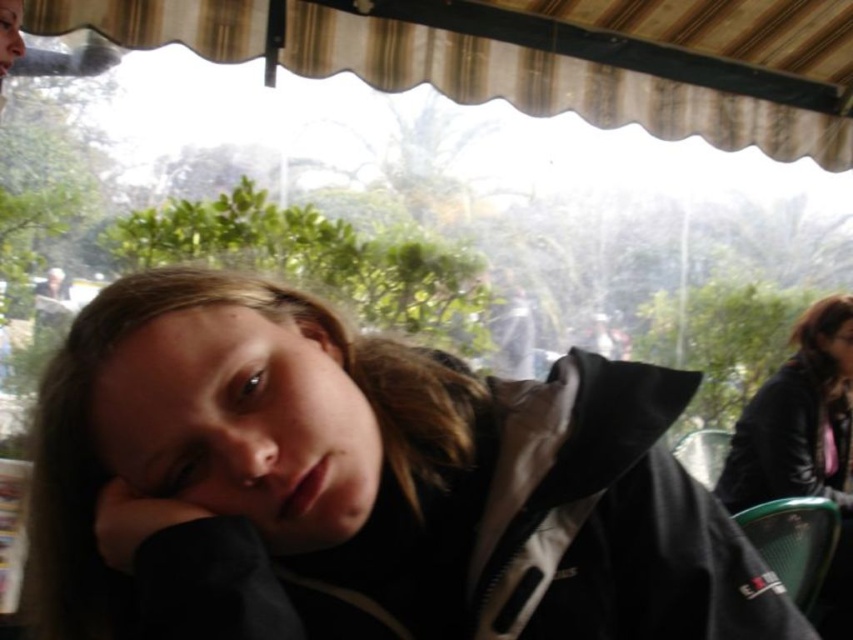
Question: Among these objects, which one is nearest to the camera?

Choices:
 (A) black leather jacket at upper right
 (B) beige fabric canopy at upper center
 (C) black matte jacket at center

Answer: (C)

Question: Can you confirm if black matte jacket at center is smaller than black leather jacket at upper right?

Choices:
 (A) yes
 (B) no

Answer: (A)

Question: Is black matte jacket at center above black leather jacket at upper right?

Choices:
 (A) yes
 (B) no

Answer: (A)

Question: Which is nearer to the black leather jacket at upper right?

Choices:
 (A) black matte jacket at center
 (B) beige fabric canopy at upper center

Answer: (B)

Question: Does beige fabric canopy at upper center have a greater width compared to black leather jacket at upper right?

Choices:
 (A) yes
 (B) no

Answer: (A)

Question: Which point is farther to the camera?

Choices:
 (A) (314, 54)
 (B) (741, 467)

Answer: (A)